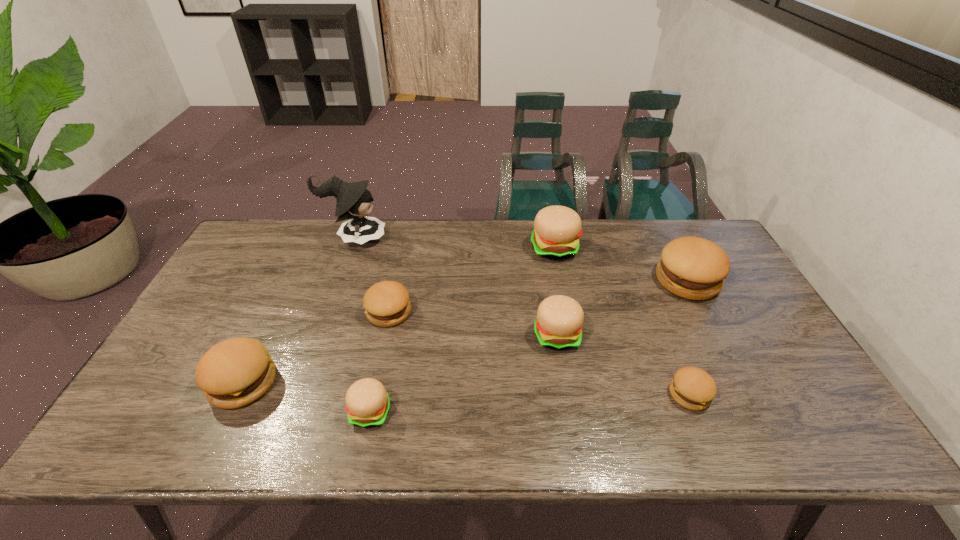
Where is `doll`? The image size is (960, 540). doll is located at coordinates (354, 201).

Find the location of a particular element. This screenshot has width=960, height=540. the farthest beige hamburger is located at coordinates (557, 229).

Find the location of a particular element. the biggest brown hamburger is located at coordinates (693, 268).

Identify the location of the second nearest beige hamburger. The height and width of the screenshot is (540, 960). (558, 325).

You are a GUI agent. You are given a task and a screenshot of the screen. Output one action in this format:
    pyautogui.click(x=<x>, y=<y>)
    Task: Click on the leftmost brown hamburger
    The image size is (960, 540).
    Given the screenshot: What is the action you would take?
    pyautogui.click(x=236, y=372)

At what (x,y) coordinates should I click in order to perform the action: click on the second biggest brown hamburger. Please return your answer as a coordinate pair (x, y). The height and width of the screenshot is (540, 960). Looking at the image, I should click on (236, 372).

At what (x,y) coordinates should I click in order to perform the action: click on the third brown hamburger from right to left. Please return your answer as a coordinate pair (x, y). The width and height of the screenshot is (960, 540). Looking at the image, I should click on (386, 303).

The width and height of the screenshot is (960, 540). Identify the location of the nearest beige hamburger. (367, 403).

The width and height of the screenshot is (960, 540). In order to click on the leftmost beige hamburger in this screenshot , I will do `click(367, 403)`.

Image resolution: width=960 pixels, height=540 pixels. I want to click on the shortest object, so click(693, 388).